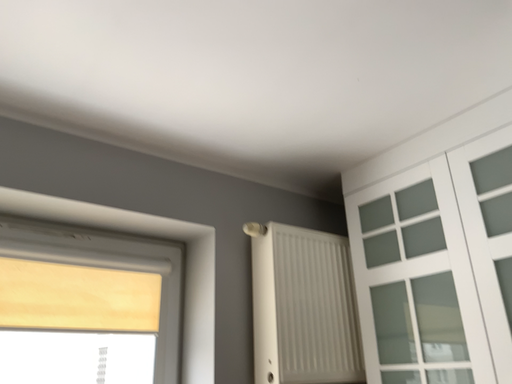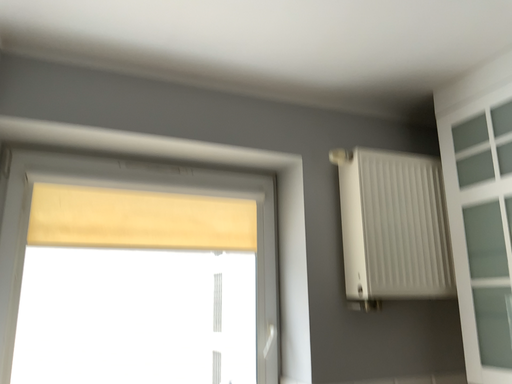
Question: How did the camera likely rotate when shooting the video?

Choices:
 (A) rotated right
 (B) rotated left

Answer: (B)